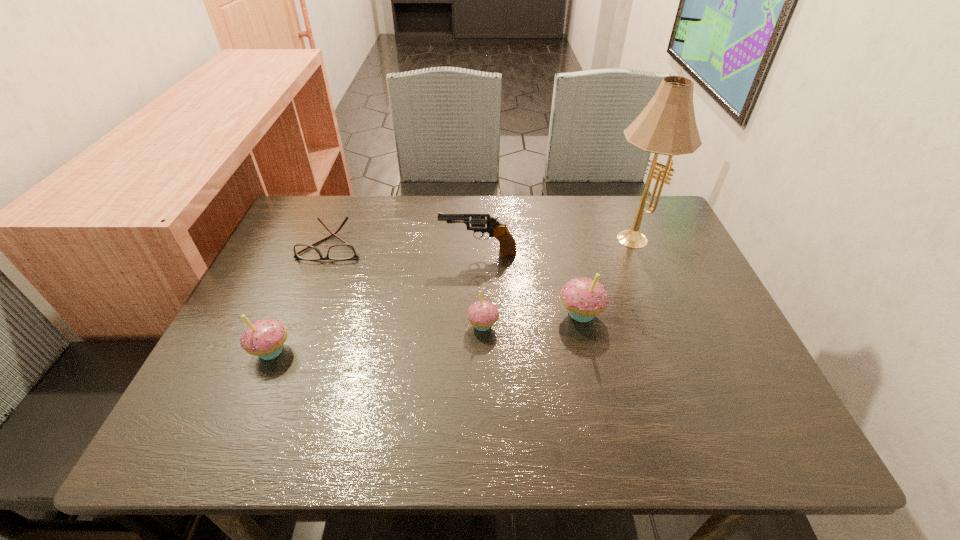
Locate an element on the screen. This screenshot has height=540, width=960. free space located 0.370m on the back of the second cupcake from right to left is located at coordinates (482, 220).

In order to click on free space located on the right of the tallest cupcake in this screenshot , I will do `click(663, 313)`.

Locate an element on the screen. vacant space located on the front of the rightmost object is located at coordinates (658, 293).

At what (x,y) coordinates should I click in order to perform the action: click on vacant space located 0.370m along the barrel of the gun. Please return your answer as a coordinate pair (x, y). The image size is (960, 540). Looking at the image, I should click on (303, 252).

Locate an element on the screen. Image resolution: width=960 pixels, height=540 pixels. vacant space situated 0.190m along the barrel of the gun is located at coordinates (370, 252).

Identify the location of vacant space located 0.190m along the barrel of the gun. (370, 252).

This screenshot has height=540, width=960. Identify the location of vacant area located 0.360m on the front-facing side of the shortest object. (280, 378).

At what (x,y) coordinates should I click in order to perform the action: click on lampshade that is at the far edge. Please return your answer as a coordinate pair (x, y). The width and height of the screenshot is (960, 540). Looking at the image, I should click on (667, 125).

This screenshot has height=540, width=960. What are the coordinates of `spectacles present at the far edge` in the screenshot? It's located at (344, 251).

You are a GUI agent. You are given a task and a screenshot of the screen. Output one action in this format:
    pyautogui.click(x=<x>, y=<y>)
    Task: Click on the object located at the near edge
    
    Given the screenshot: What is the action you would take?
    pyautogui.click(x=264, y=338)